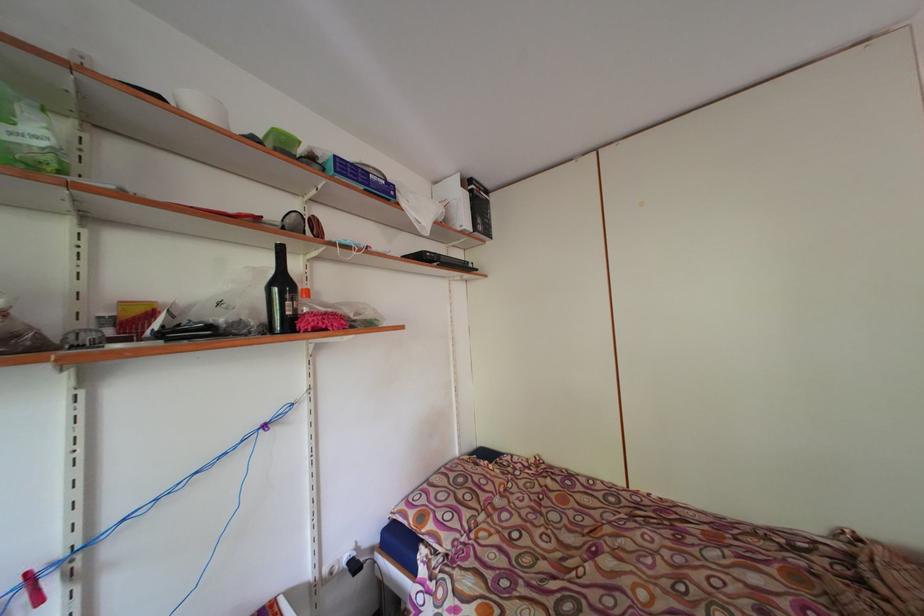
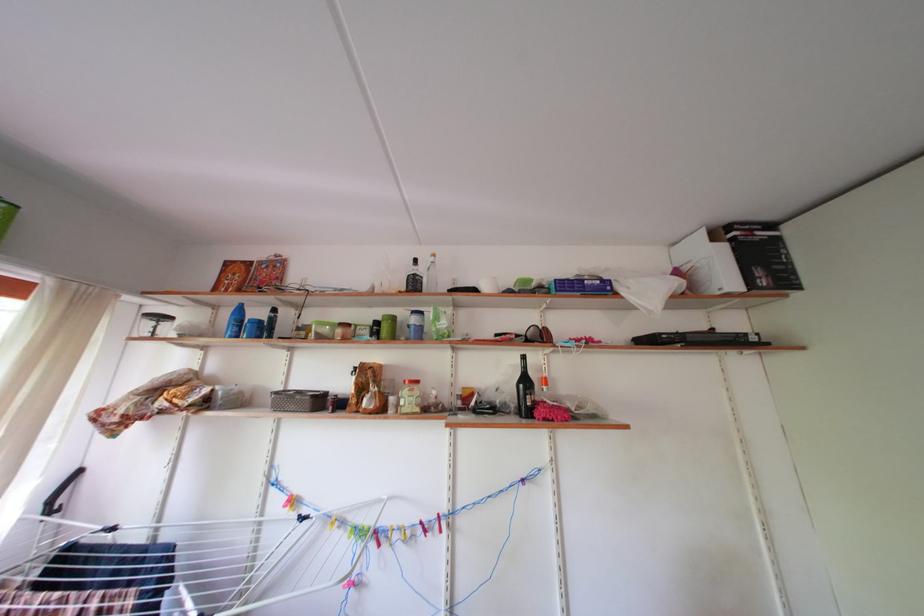
Where in the second image is the point corresponding to (290,289) from the first image?

(533, 387)